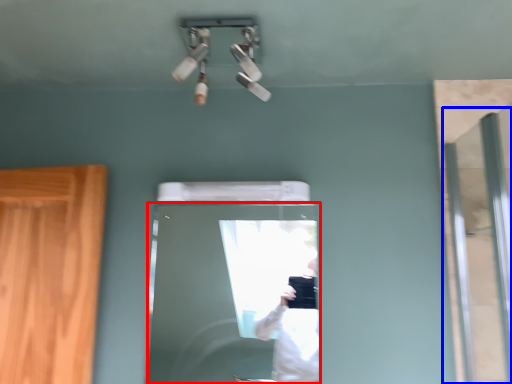
Question: Which object appears farthest to the camera in this image, door (highlighted by a red box) or screen door (highlighted by a blue box)?

Choices:
 (A) door
 (B) screen door

Answer: (A)